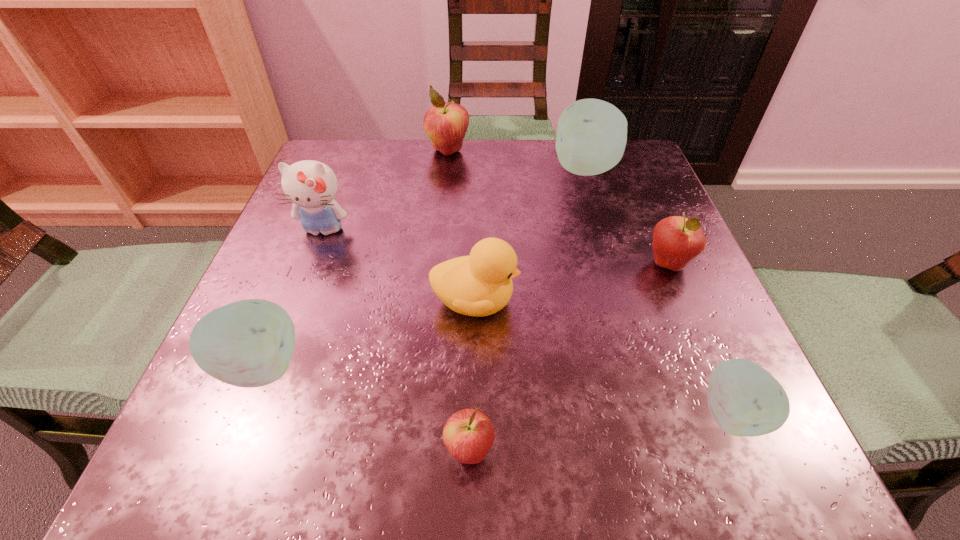
At what (x,y) coordinates should I click in order to perform the action: click on the farthest red apple. Please return your answer as a coordinate pair (x, y). Looking at the image, I should click on pos(445,123).

In order to click on the farthest white apple in this screenshot , I will do `click(591, 138)`.

You are a GUI agent. You are given a task and a screenshot of the screen. Output one action in this format:
    pyautogui.click(x=<x>, y=<y>)
    Task: Click on the third farthest object
    
    Given the screenshot: What is the action you would take?
    pyautogui.click(x=311, y=186)

Locate an element on the screen. Image resolution: width=960 pixels, height=540 pixels. duck is located at coordinates (480, 284).

Locate an element on the screen. the second farthest red apple is located at coordinates (677, 240).

The image size is (960, 540). I want to click on the fourth nearest apple, so click(x=677, y=240).

You are a GUI agent. You are given a task and a screenshot of the screen. Output one action in this format:
    pyautogui.click(x=<x>, y=<y>)
    Task: Click on the second biggest white apple
    
    Given the screenshot: What is the action you would take?
    249,343

Where is `the leftmost white apple`? The width and height of the screenshot is (960, 540). the leftmost white apple is located at coordinates (249, 343).

The height and width of the screenshot is (540, 960). Find the location of `the smallest white apple`. the smallest white apple is located at coordinates (745, 400).

Locate an element on the screen. the nearest red apple is located at coordinates (468, 435).